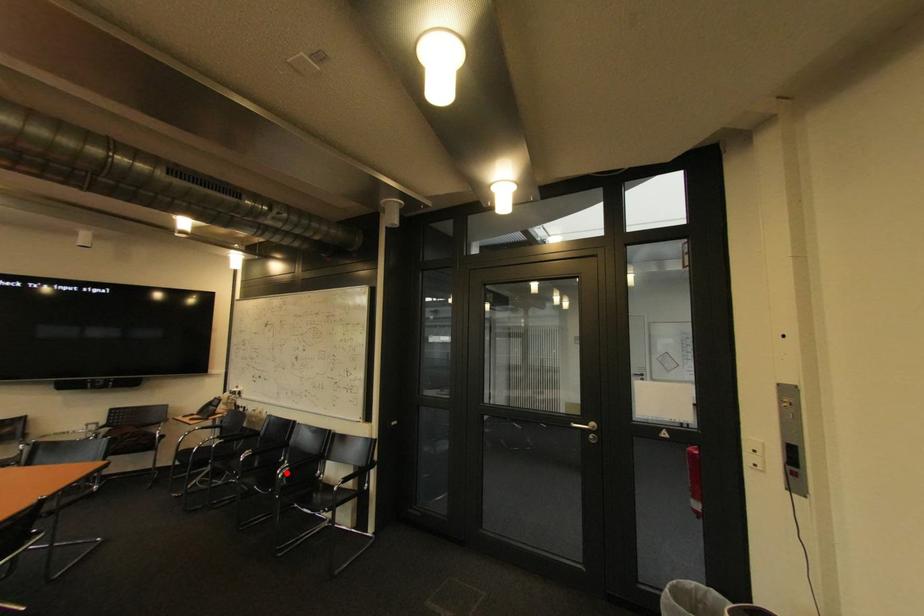
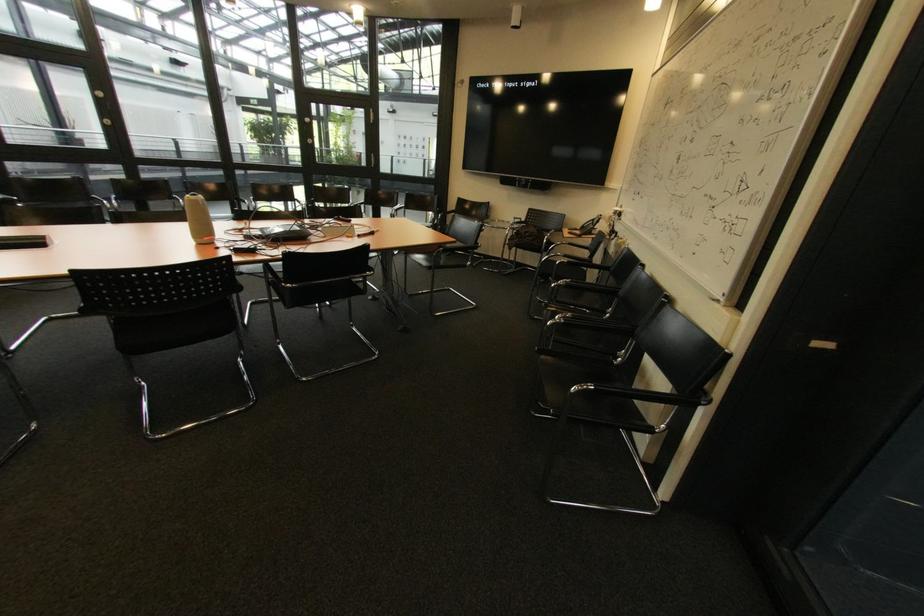
Where in the second image is the point corresponding to the highlighted location from the first image?

(565, 318)